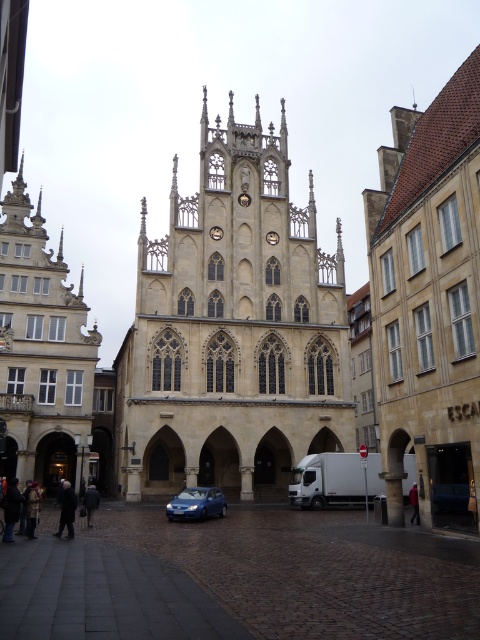
Does point (443, 92) come behind point (34, 506)?

Yes, point (443, 92) is farther from viewer.

Is brown stone church at center positioned behind dark brown leather jacket at lower left?

No.

Does point (380, 163) come closer to viewer compared to point (35, 520)?

No, it is behind (35, 520).

Locate an element on the screen. The width and height of the screenshot is (480, 640). brown stone church at center is located at coordinates (430, 300).

Can you confirm if dark brown leather coat at lower left is bigger than dark brown leather jacket at lower left?

Indeed, dark brown leather coat at lower left has a larger size compared to dark brown leather jacket at lower left.

Is point (10, 490) positioned behind point (35, 524)?

Yes, it is behind point (35, 524).

Locate an element on the screen. dark brown leather coat at lower left is located at coordinates (11, 508).

Which is more to the right, dark brown leather coat at lower left or dark gray coat at lower left?

dark gray coat at lower left is more to the right.

Does dark brown leather coat at lower left lie in front of dark gray coat at lower left?

Yes.

Who is more distant from viewer, (11, 525) or (88, 515)?

The point (88, 515) is behind.

Find the location of a particular element. This screenshot has width=480, height=640. dark brown leather coat at lower left is located at coordinates (11, 508).